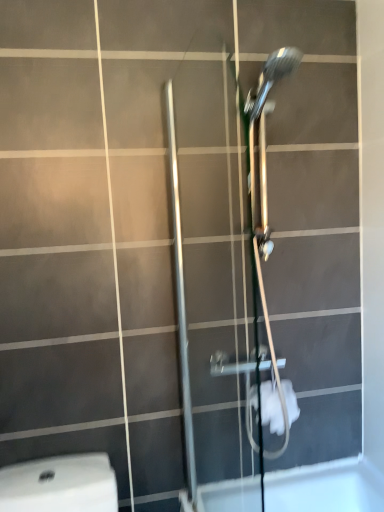
Describe the element at coordinates (262, 231) in the screenshot. The width and height of the screenshot is (384, 512). I see `satin nickel shower door at center` at that location.

The image size is (384, 512). Identify the location of satin nickel shower door at center. (262, 231).

You are a GUI agent. You are given a task and a screenshot of the screen. Output one action in this format:
    pyautogui.click(x=<x>, y=<y>)
    Task: Click on the white fabric toilet paper at lower center
    The image size is (384, 512).
    Given the screenshot: What is the action you would take?
    pyautogui.click(x=271, y=408)

The height and width of the screenshot is (512, 384). Describe the element at coordinates (271, 408) in the screenshot. I see `white fabric toilet paper at lower center` at that location.

Where is `satin nickel shower door at center`? Image resolution: width=384 pixels, height=512 pixels. satin nickel shower door at center is located at coordinates (262, 231).

Does white fabric toilet paper at lower center appear on the right side of satin nickel shower door at center?

Yes, white fabric toilet paper at lower center is to the right of satin nickel shower door at center.

Considering their positions, is white fabric toilet paper at lower center located in front of or behind satin nickel shower door at center?

Clearly, white fabric toilet paper at lower center is behind satin nickel shower door at center.

Considering the positions of point (293, 407) and point (189, 425), is point (293, 407) closer or farther from the camera than point (189, 425)?

Clearly, point (293, 407) is closer to the camera than point (189, 425).

From the image's perspective, between white fabric toilet paper at lower center and satin nickel shower door at center, who is located below?

white fabric toilet paper at lower center is shown below in the image.

From a real-world perspective, is white fabric toilet paper at lower center physically above satin nickel shower door at center?

Incorrect, from a real-world perspective, white fabric toilet paper at lower center is lower than satin nickel shower door at center.

In terms of width, does white fabric toilet paper at lower center look wider or thinner when compared to satin nickel shower door at center?

In the image, white fabric toilet paper at lower center appears to be wider than satin nickel shower door at center.

Considering the sizes of white fabric toilet paper at lower center and satin nickel shower door at center in the image, is white fabric toilet paper at lower center taller or shorter than satin nickel shower door at center?

Clearly, white fabric toilet paper at lower center is shorter compared to satin nickel shower door at center.

Is white fabric toilet paper at lower center bigger or smaller than satin nickel shower door at center?

In the image, white fabric toilet paper at lower center appears to be smaller than satin nickel shower door at center.

Which is correct: white fabric toilet paper at lower center is inside satin nickel shower door at center, or outside of it?

white fabric toilet paper at lower center is not inside satin nickel shower door at center, it's outside.

Is white fabric toilet paper at lower center positioned far away from satin nickel shower door at center?

No, white fabric toilet paper at lower center is in close proximity to satin nickel shower door at center.

Is white fabric toilet paper at lower center facing away from satin nickel shower door at center?

No, white fabric toilet paper at lower center's orientation is not away from satin nickel shower door at center.

How many degrees apart are the facing directions of white fabric toilet paper at lower center and satin nickel shower door at center?

The angle between the facing direction of white fabric toilet paper at lower center and the facing direction of satin nickel shower door at center is 89 degrees.

Based on the photo, measure the distance between white fabric toilet paper at lower center and satin nickel shower door at center.

The distance of white fabric toilet paper at lower center from satin nickel shower door at center is 30.35 centimeters.

At what (x,y) coordinates should I click in order to perform the action: click on toilet paper beneath the satin nickel shower door at center (from a real-world perspective). Please return your answer as a coordinate pair (x, y). Image resolution: width=384 pixels, height=512 pixels. Looking at the image, I should click on (271, 408).

Considering the positions of objects satin nickel shower door at center and white fabric toilet paper at lower center in the image provided, who is more to the right, satin nickel shower door at center or white fabric toilet paper at lower center?

From the viewer's perspective, white fabric toilet paper at lower center appears more on the right side.

Which is in front, satin nickel shower door at center or white fabric toilet paper at lower center?

satin nickel shower door at center is closer to the camera.

Considering the points (267, 233) and (288, 389), which point is behind, point (267, 233) or point (288, 389)?

The point (288, 389) is more distant.

From the image's perspective, would you say satin nickel shower door at center is positioned over white fabric toilet paper at lower center?

Correct, satin nickel shower door at center appears higher than white fabric toilet paper at lower center in the image.

From a real-world perspective, is satin nickel shower door at center below white fabric toilet paper at lower center?

No, from a real-world perspective, satin nickel shower door at center is not under white fabric toilet paper at lower center.

Based on the photo, between satin nickel shower door at center and white fabric toilet paper at lower center, which one has larger width?

Wider between the two is white fabric toilet paper at lower center.

From their relative heights in the image, would you say satin nickel shower door at center is taller or shorter than white fabric toilet paper at lower center?

Clearly, satin nickel shower door at center is taller compared to white fabric toilet paper at lower center.

Considering the sizes of objects satin nickel shower door at center and white fabric toilet paper at lower center in the image provided, who is bigger, satin nickel shower door at center or white fabric toilet paper at lower center?

satin nickel shower door at center.

Is satin nickel shower door at center surrounding white fabric toilet paper at lower center?

No, white fabric toilet paper at lower center is not a part of satin nickel shower door at center.

Is satin nickel shower door at center beside white fabric toilet paper at lower center?

No, satin nickel shower door at center is not next to white fabric toilet paper at lower center.

Could you tell me if satin nickel shower door at center is facing white fabric toilet paper at lower center?

No, satin nickel shower door at center is not turned towards white fabric toilet paper at lower center.

The width and height of the screenshot is (384, 512). Identify the location of shower door that appears above the white fabric toilet paper at lower center (from the image's perspective). (262, 231).

Find the location of `shower door to the left of white fabric toilet paper at lower center`. shower door to the left of white fabric toilet paper at lower center is located at coordinates (262, 231).

Image resolution: width=384 pixels, height=512 pixels. In the image, there is a white fabric toilet paper at lower center. What are the coordinates of `shower door above it (from the image's perspective)` in the screenshot? It's located at point(262,231).